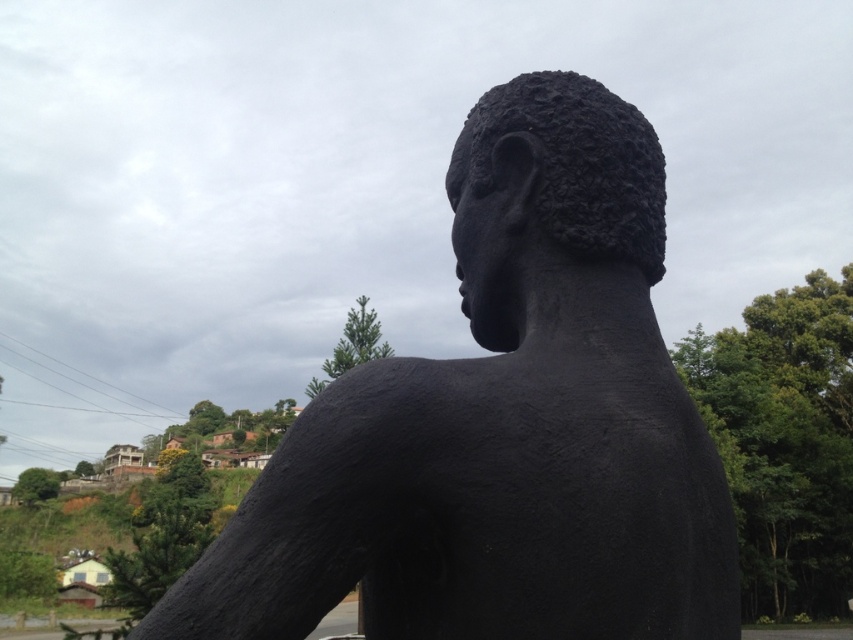
Question: Which point is farther to the camera?

Choices:
 (A) (595, 218)
 (B) (646, 250)

Answer: (B)

Question: Can you confirm if black matte bust at center is positioned below black matte head at center?

Choices:
 (A) no
 (B) yes

Answer: (B)

Question: Among these points, which one is farthest from the camera?

Choices:
 (A) (521, 540)
 (B) (589, 148)

Answer: (B)

Question: Is black matte bust at center thinner than black matte head at center?

Choices:
 (A) no
 (B) yes

Answer: (A)

Question: Which point is farther to the camera?

Choices:
 (A) (451, 486)
 (B) (662, 243)

Answer: (B)

Question: Is black matte bust at center wider than black matte head at center?

Choices:
 (A) yes
 (B) no

Answer: (A)